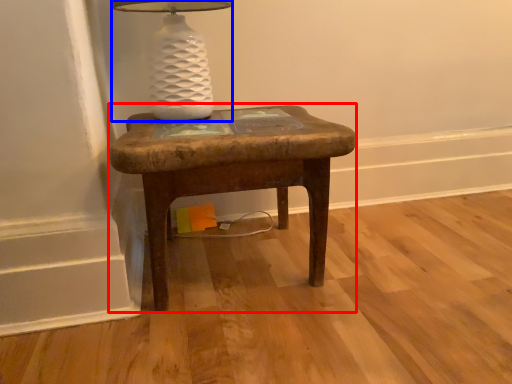
Question: Which object appears closest to the camera in this image, stool (highlighted by a red box) or table lamp (highlighted by a blue box)?

Choices:
 (A) stool
 (B) table lamp

Answer: (A)